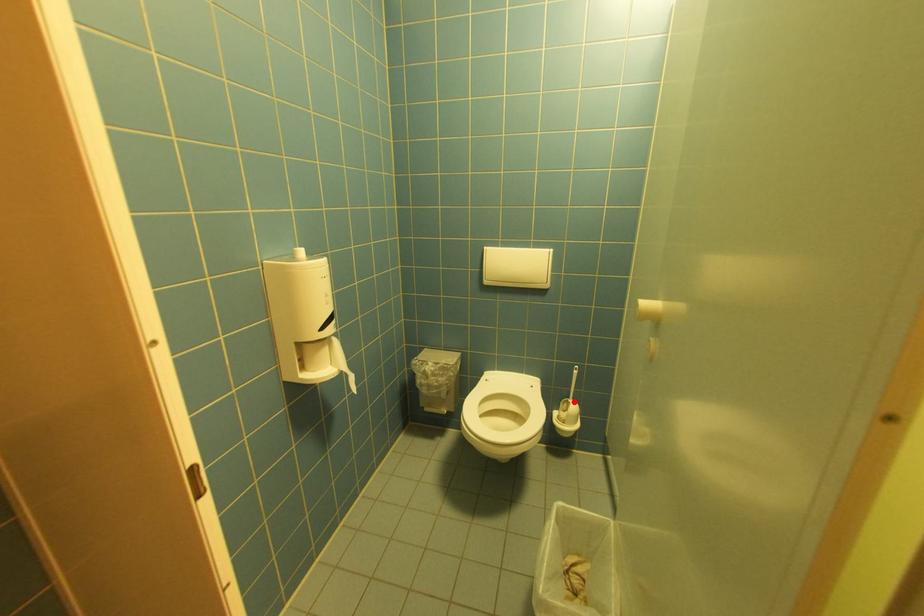
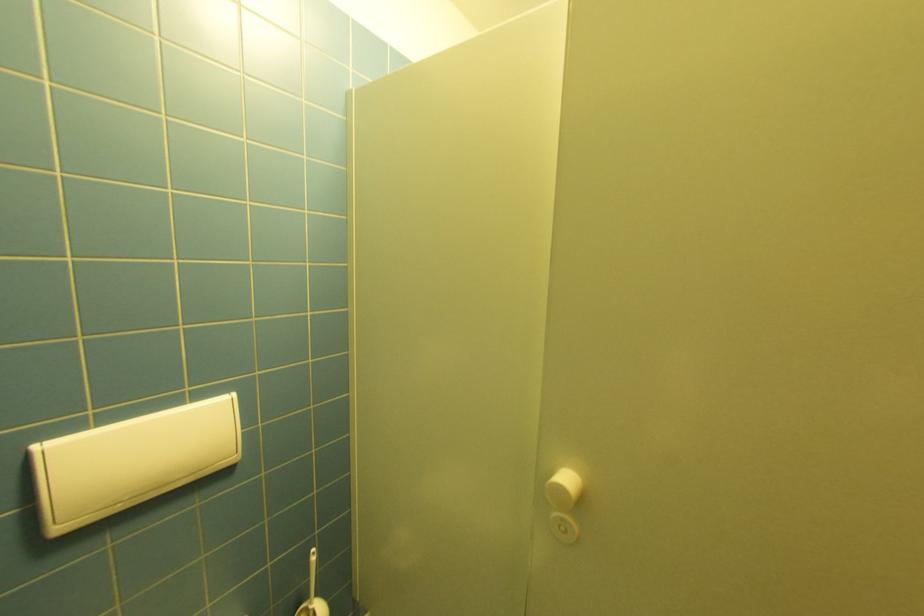
Where in the second image is the point corresponding to the highlighted location from the first image?

(312, 610)